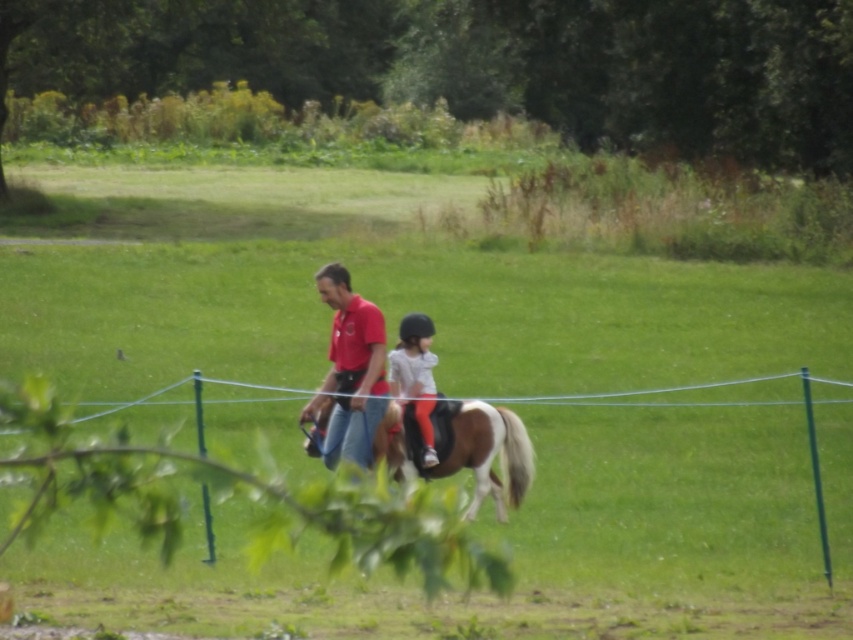
You are a photographer planning to take a photo of the scene. You need to ensure that the brown glossy horse at center and the light gray fabric helmet at center are both clearly visible. Given that the horse is wider than the helmet, which object should you adjust your camera focus on to ensure both are in frame without cropping?

Since the brown glossy horse at center is wider than the light gray fabric helmet at center, you should focus on the brown glossy horse at center to ensure both objects are in frame without cropping, as it requires more space.

You are a photographer standing in the field and want to take a photo of the brown glossy horse at center without the blue wire fence at center appearing in the foreground. Is this possible based on their positions?

The blue wire fence at center is closer to the viewer than the brown glossy horse at center, so it will block the view of the horse. Therefore, it is not possible to take a photo of the brown glossy horse at center without the blue wire fence at center appearing in the foreground.